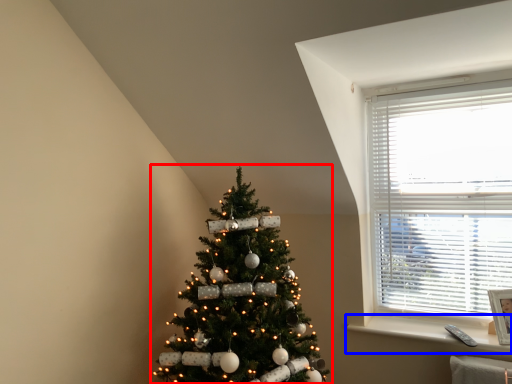
Question: Which object is further to the camera taking this photo, christmas tree (highlighted by a red box) or window sill (highlighted by a blue box)?

Choices:
 (A) christmas tree
 (B) window sill

Answer: (B)